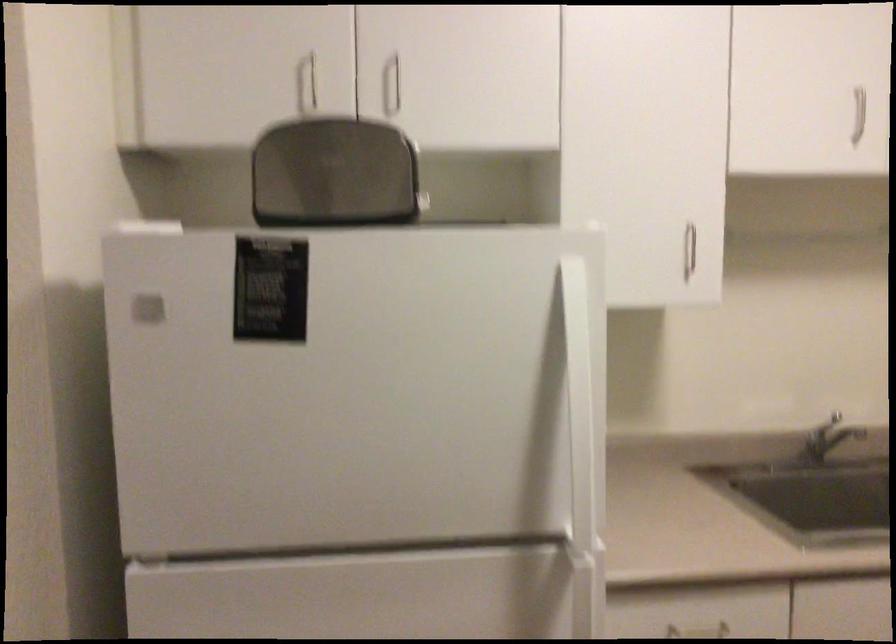
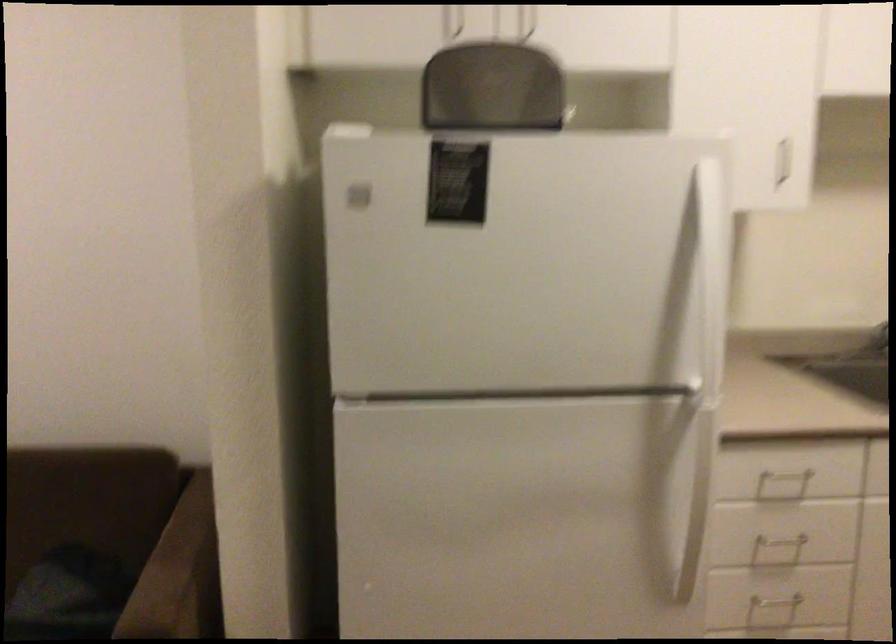
The point at (576, 404) is marked in the first image. Where is the corresponding point in the second image?

(711, 272)